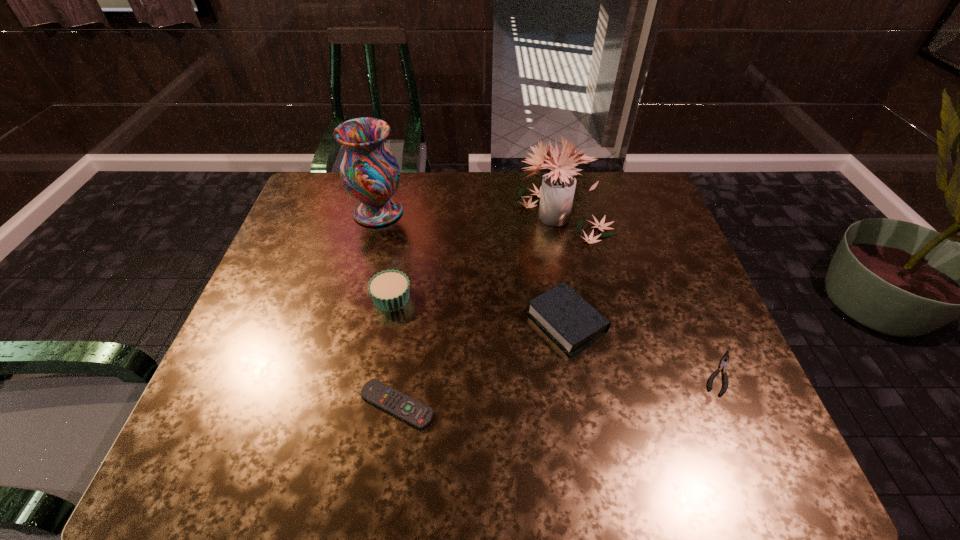
You are a GUI agent. You are given a task and a screenshot of the screen. Output one action in this format:
    pyautogui.click(x=<x>, y=<y>)
    Task: Click on the free space located on the front of the third shortest object
    The image size is (960, 540).
    Given the screenshot: What is the action you would take?
    pyautogui.click(x=584, y=421)

Where is `vacant position located on the right of the remote control`? This screenshot has width=960, height=540. vacant position located on the right of the remote control is located at coordinates (483, 404).

The width and height of the screenshot is (960, 540). I want to click on free space located on the left of the rightmost object, so click(x=541, y=373).

This screenshot has height=540, width=960. I want to click on vase that is at the far edge, so click(369, 172).

Locate an element on the screen. This screenshot has width=960, height=540. bouquet positioned at the far edge is located at coordinates (556, 194).

In order to click on bouquet positioned at the right edge in this screenshot , I will do `click(556, 194)`.

Where is `pliers at the right edge`? The width and height of the screenshot is (960, 540). pliers at the right edge is located at coordinates (724, 362).

You are a GUI agent. You are given a task and a screenshot of the screen. Output one action in this format:
    pyautogui.click(x=<x>, y=<y>)
    Task: Click on the object located in the far right corner section of the desktop
    This screenshot has width=960, height=540.
    Given the screenshot: What is the action you would take?
    pyautogui.click(x=556, y=194)

Image resolution: width=960 pixels, height=540 pixels. In the image, there is a desktop. What are the coordinates of `free space at the far edge` in the screenshot? It's located at (582, 184).

Find the location of `vacant region at the near edge`. vacant region at the near edge is located at coordinates (381, 436).